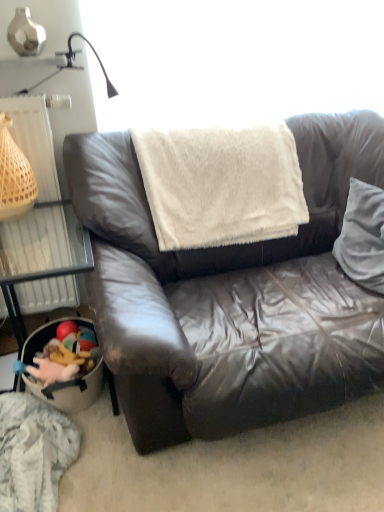
Question: Visually, is plush toy at lower left positioned to the left or to the right of beige woven basket at left?

Choices:
 (A) right
 (B) left

Answer: (A)

Question: Is point (44, 382) positioned closer to the camera than point (18, 170)?

Choices:
 (A) closer
 (B) farther

Answer: (B)

Question: Which object is positioned farthest from the white plastic radiator at left?

Choices:
 (A) white soft pillow at right
 (B) wooden toy basket at lower left
 (C) white fluffy blanket at center
 (D) beige woven basket at left
 (E) fluffy gray blanket at lower left

Answer: (A)

Question: Which object is positioned farthest from the plush toy at lower left?

Choices:
 (A) wooden toy basket at lower left
 (B) white plastic radiator at left
 (C) white soft pillow at right
 (D) beige woven basket at left
 (E) white fluffy blanket at center

Answer: (C)